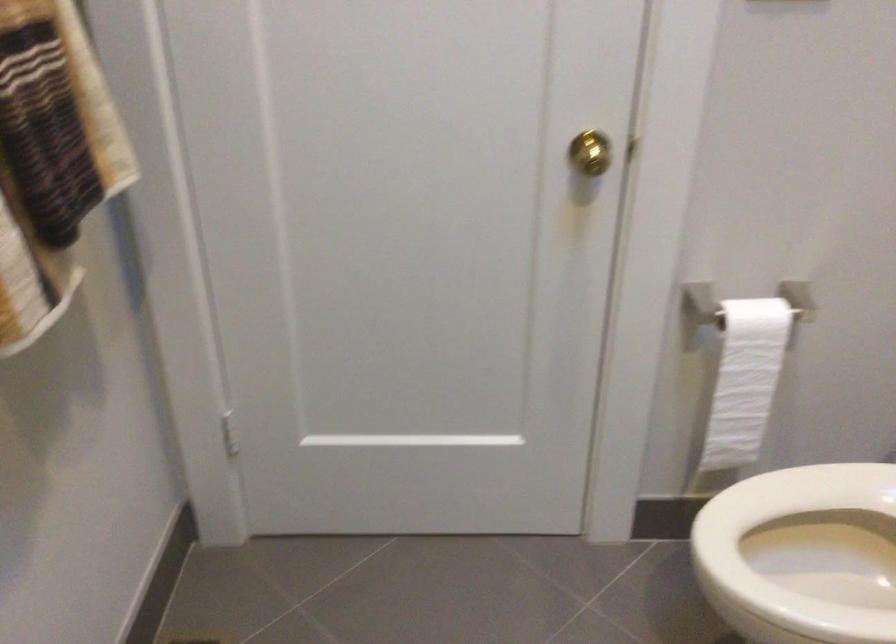
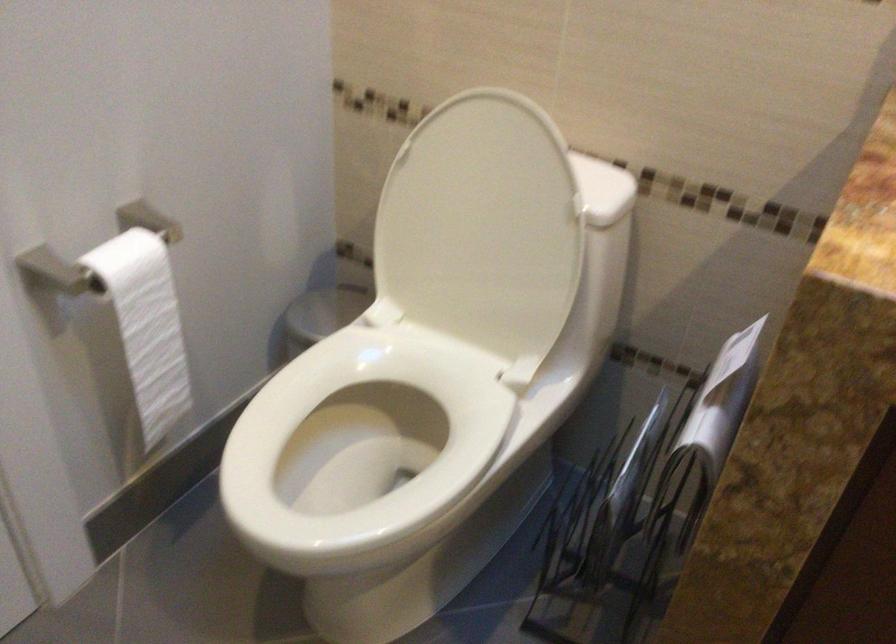
The point at (743,371) is marked in the first image. Where is the corresponding point in the second image?

(147, 325)